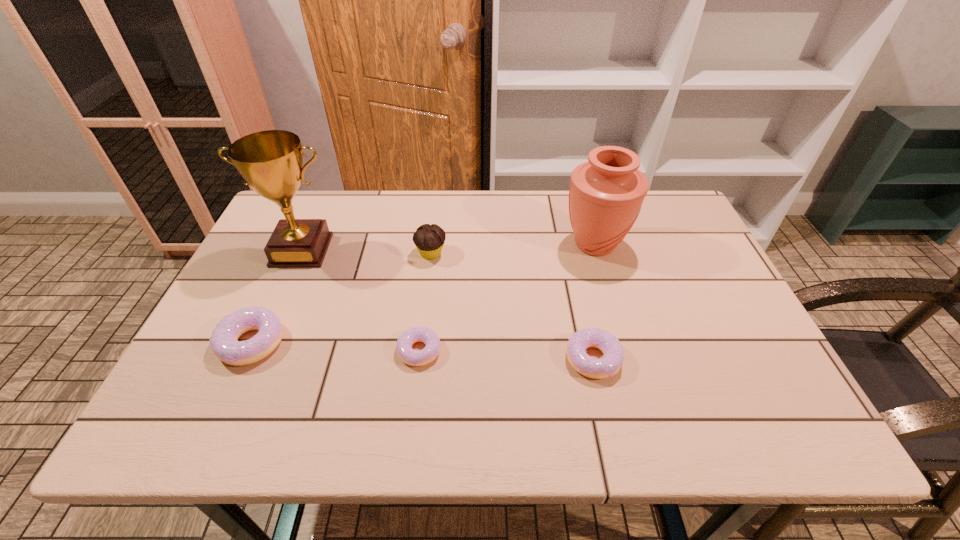
Locate an element on the screen. The height and width of the screenshot is (540, 960). object that is at the near left corner is located at coordinates (224, 342).

What are the coordinates of `free space at the far edge of the desktop` in the screenshot? It's located at (469, 225).

This screenshot has width=960, height=540. Find the location of `vacant area at the near edge`. vacant area at the near edge is located at coordinates (471, 378).

I want to click on free space at the left edge of the desktop, so click(279, 276).

At what (x,y) coordinates should I click in order to perform the action: click on free region at the far left corner. Please return your answer as a coordinate pair (x, y). The image size is (960, 540). Looking at the image, I should click on (267, 228).

Locate an element on the screen. free space at the far right corner of the desktop is located at coordinates (669, 207).

You are a GUI agent. You are given a task and a screenshot of the screen. Output one action in this format:
    pyautogui.click(x=<x>, y=<y>)
    Task: Click on the free point between the fourth shortest object and the shortest doughnut
    
    Given the screenshot: What is the action you would take?
    pyautogui.click(x=425, y=302)

This screenshot has width=960, height=540. I want to click on unoccupied area between the award and the third shortest object, so click(x=276, y=296).

The height and width of the screenshot is (540, 960). Identify the location of unoccupied position between the tallest doughnut and the vase. (423, 294).

The height and width of the screenshot is (540, 960). Identify the location of blank region between the second doughnut from right to left and the award. (361, 300).